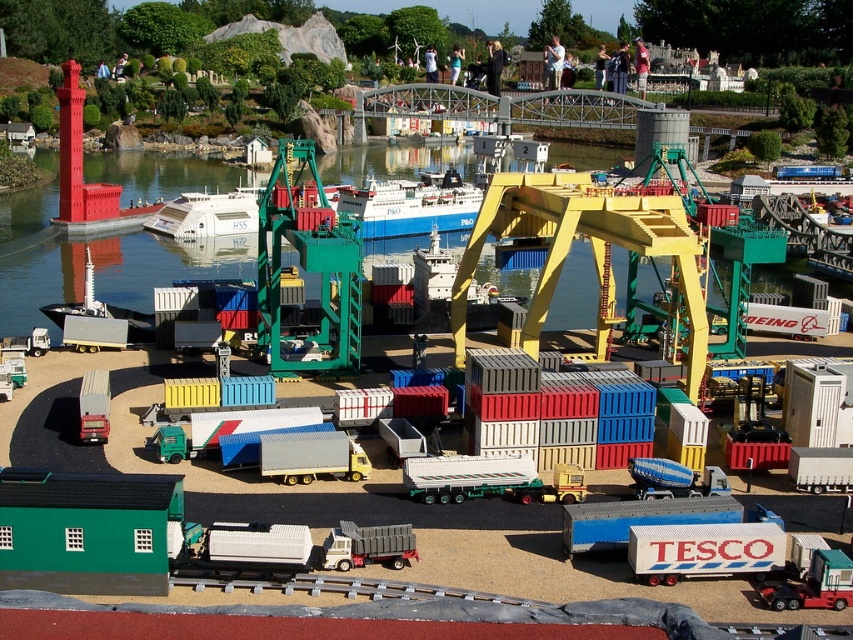
Question: Is white plastic boat at center further to the viewer compared to metallic green truck at center?

Choices:
 (A) no
 (B) yes

Answer: (B)

Question: Among these points, which one is nearest to the camera?

Choices:
 (A) (364, 182)
 (B) (375, 532)
 (C) (775, 602)

Answer: (C)

Question: Does blue matte container ship at center have a greater width compared to metallic silver truck at center?

Choices:
 (A) yes
 (B) no

Answer: (A)

Question: Which object is the farthest from the green metallic crane at center?

Choices:
 (A) white glossy ship at center
 (B) metallic silver truck at center

Answer: (B)

Question: Can you confirm if blue matte container ship at center is bigger than metallic green truck at center?

Choices:
 (A) no
 (B) yes

Answer: (B)

Question: Which of the following is the farthest from the observer?

Choices:
 (A) metallic green truck at center
 (B) white plastic boat at center
 (C) white glossy ship at center
 (D) green metallic crane at center

Answer: (C)